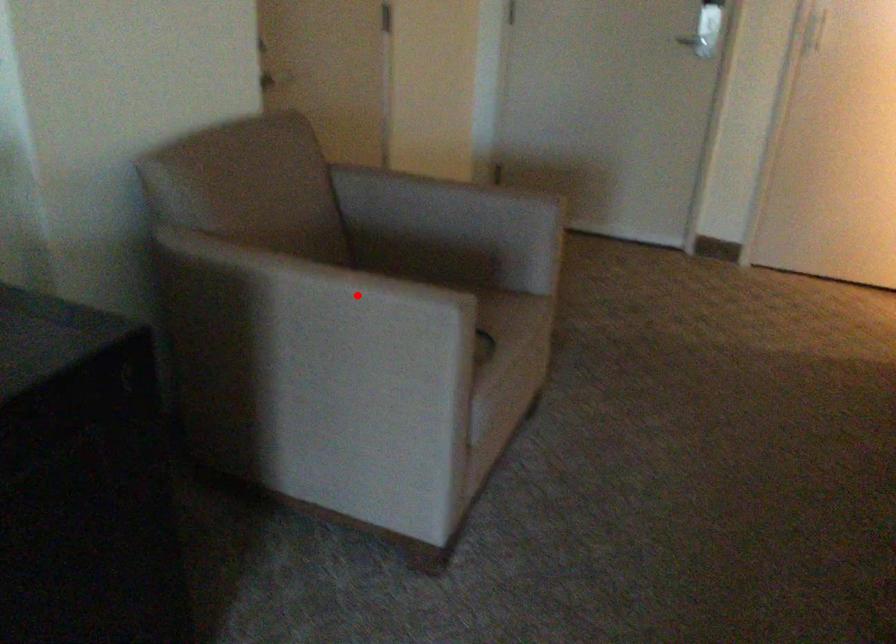
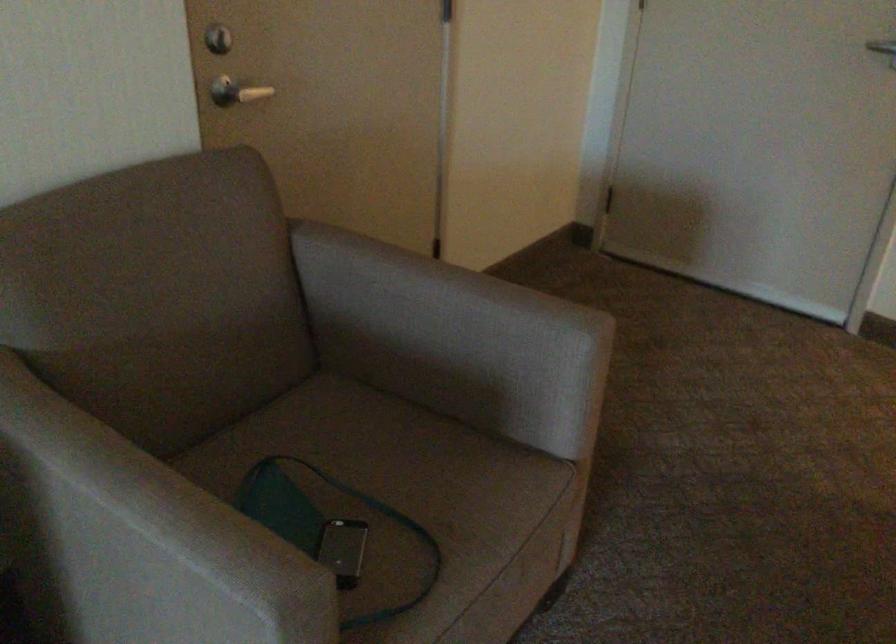
Question: I am providing you with two images of the same scene from different viewpoints. In image1, a red point is highlighted. Considering the same 3D point in image2, which of the following is correct?

Choices:
 (A) It is closer
 (B) It is farther

Answer: (A)